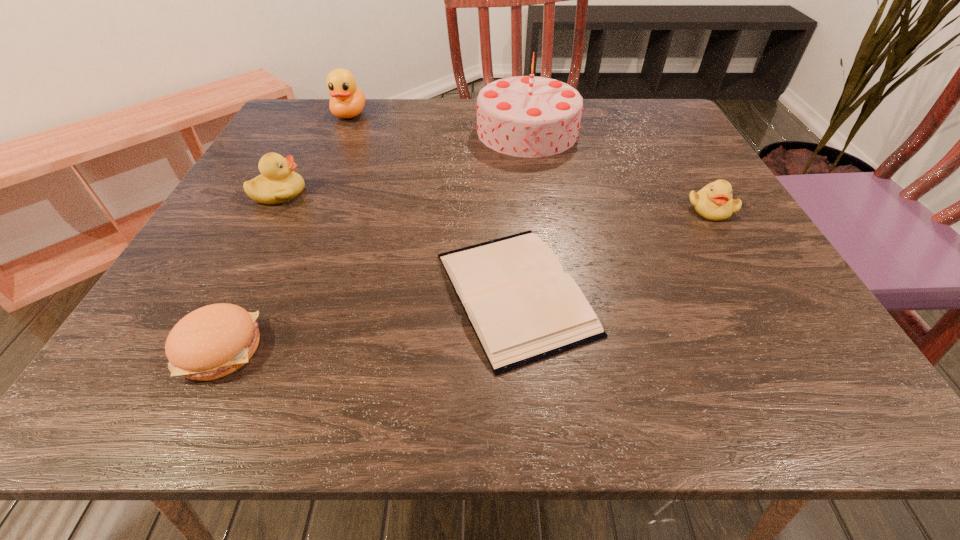
I want to click on vacant area that lies between the fifth tallest object and the tallest duckling, so click(285, 232).

Find the location of `unoccupied position between the second shortest duckling and the hardback book`. unoccupied position between the second shortest duckling and the hardback book is located at coordinates (397, 243).

Locate an element on the screen. blank region between the fourth tallest object and the fifth shortest object is located at coordinates (530, 161).

I want to click on free area in between the farthest duckling and the birthday cake, so click(x=439, y=123).

Image resolution: width=960 pixels, height=540 pixels. In order to click on vacant point located between the patty and the tallest object in this screenshot , I will do `click(374, 240)`.

You are a GUI agent. You are given a task and a screenshot of the screen. Output one action in this format:
    pyautogui.click(x=<x>, y=<y>)
    Task: Click on the fourth closest object relative to the third shortest object
    
    Given the screenshot: What is the action you would take?
    pyautogui.click(x=347, y=101)

Identify which object is the nearest to the rightmost object. Please provide its 2D coordinates. Your answer should be formatted as a tuple, i.e. [(x, y)], where the tuple contains the x and y coordinates of a point satisfying the conditions above.

[(524, 116)]

Select which duckling is the closest to the fifth shortest object. Please provide its 2D coordinates. Your answer should be formatted as a tuple, i.e. [(x, y)], where the tuple contains the x and y coordinates of a point satisfying the conditions above.

[(278, 183)]

At what (x,y) coordinates should I click in order to perform the action: click on duckling that is the second closest to the second shortest duckling. Please return your answer as a coordinate pair (x, y). The image size is (960, 540). Looking at the image, I should click on (714, 202).

You are a GUI agent. You are given a task and a screenshot of the screen. Output one action in this format:
    pyautogui.click(x=<x>, y=<y>)
    Task: Click on the blank area in the image that satisfies the following two spatial constraints: 1. on the beak of the patty; 2. on the left side of the second shortest duckling
    
    Given the screenshot: What is the action you would take?
    pyautogui.click(x=196, y=348)